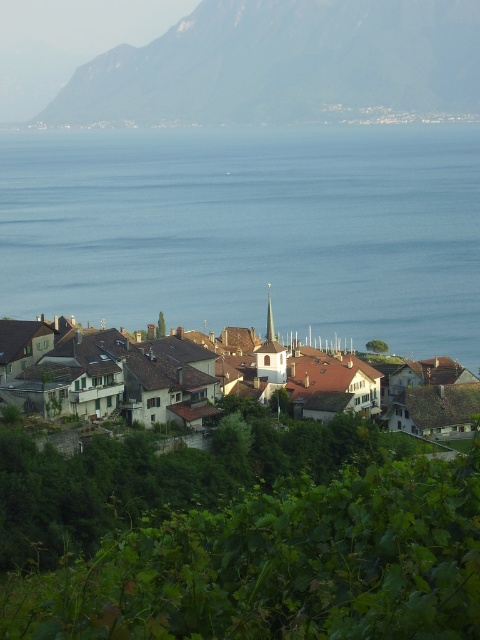
You are an architect planning to build a new observation deck in the town. You want to ensure that the view of the rocky gray mountain at upper center remains unobstructed from the deck. Given the current layout, which object might block the view if the deck is placed too close to the brown tiled roofs at center?

The brown tiled roofs at center could block the view of the rocky gray mountain at upper center because the mountain is positioned over the roofs, meaning the roofs are in front of the mountain from the deck location.

Based on the scene description, which object is positioned to the right of the other between the rocky gray mountain at upper center and the smooth gray spire at center?

The rocky gray mountain at upper center is positioned to the right of the smooth gray spire at center.

You are an artist planning to paint this scene. You want to ensure the blue water at center and the rocky gray mountain at upper center are accurately proportioned. Based on the scene, which object should you make wider in your painting?

The blue water at center should be made wider in the painting since its width surpasses that of the rocky gray mountain at upper center.